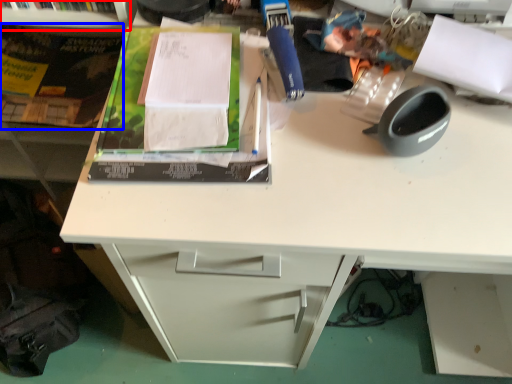
Question: Among these objects, which one is nearest to the camera, shelf (highlighted by a red box) or paperback book (highlighted by a blue box)?

Choices:
 (A) shelf
 (B) paperback book

Answer: (A)